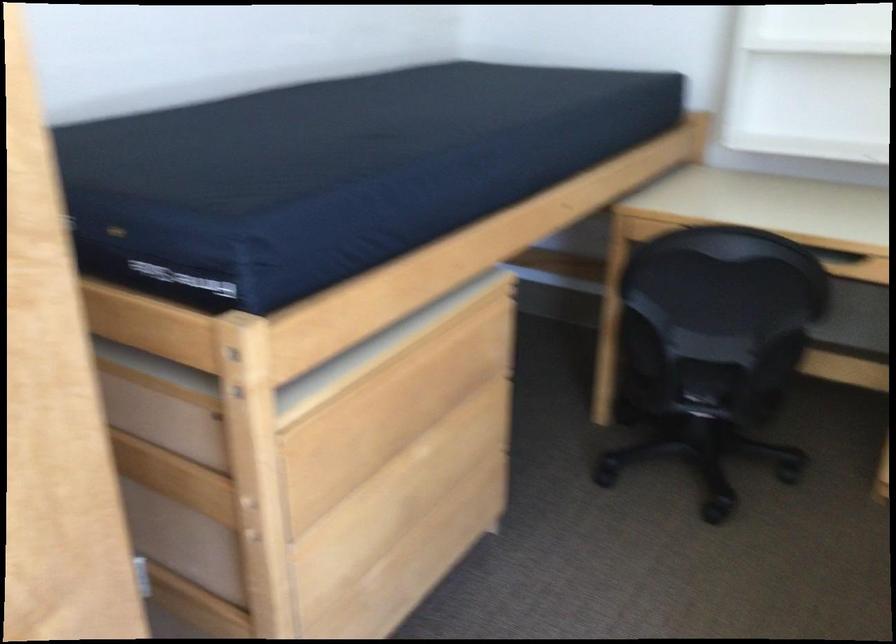
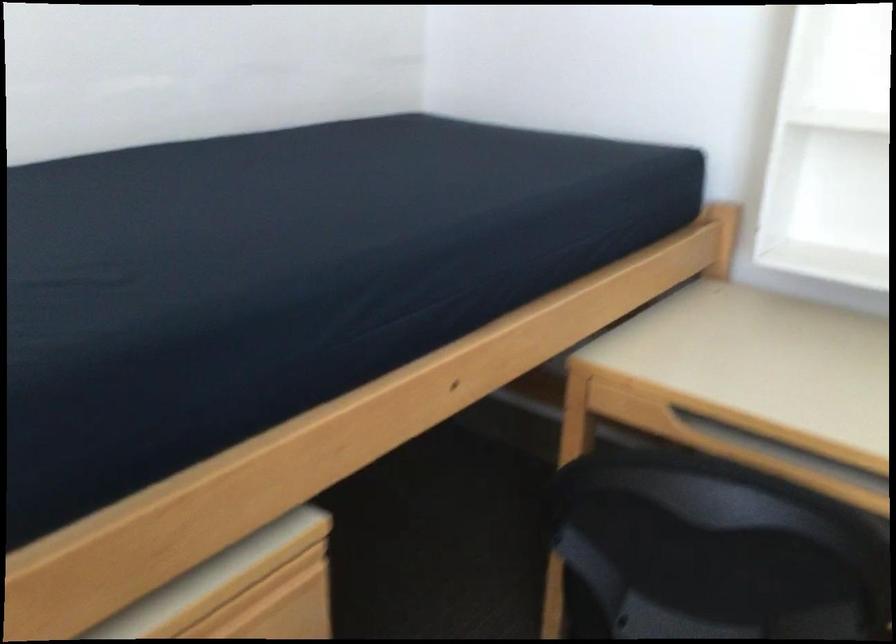
Question: Based on the continuous images, in which direction is the camera rotating? Reply with the corresponding letter.

Choices:
 (A) Left
 (B) Right
 (C) Up
 (D) Down

Answer: (A)